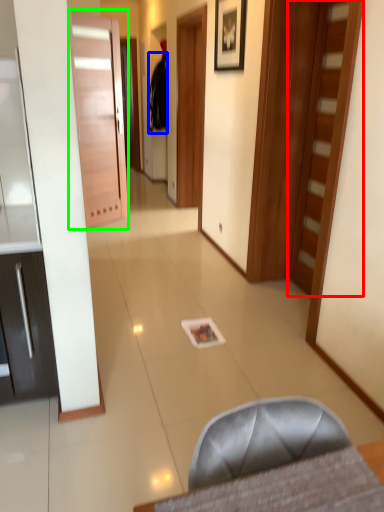
Question: Considering the real-world distances, which object is farthest from door (highlighted by a red box)? robe (highlighted by a blue box) or door (highlighted by a green box)?

Choices:
 (A) robe
 (B) door

Answer: (A)